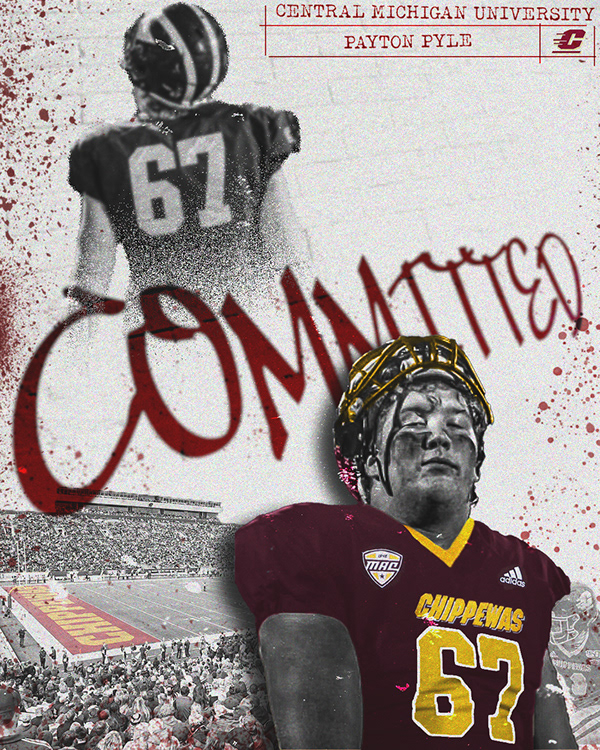
Identify the location of fans. (194, 690).